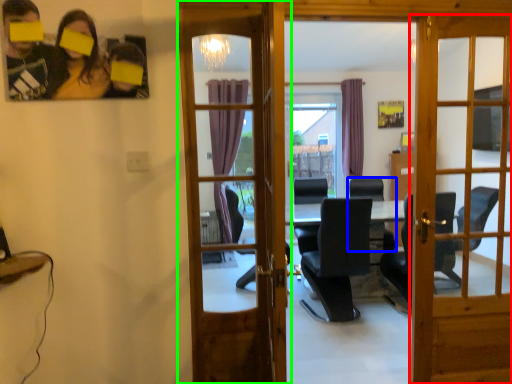
Question: Which is nearer to the door (highlighted by a red box)? chair (highlighted by a blue box) or door (highlighted by a green box).

Choices:
 (A) chair
 (B) door

Answer: (A)